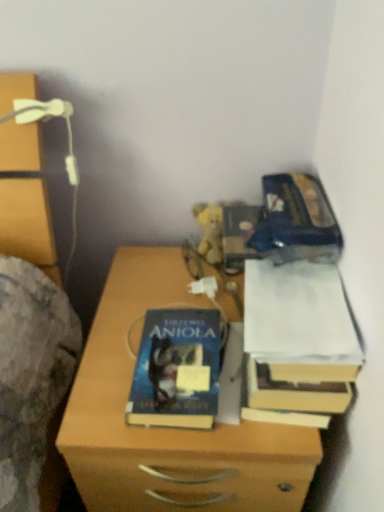
At what (x,y) coordinates should I click in order to perform the action: click on vacant space to the left of hardcover book at center. Please return your answer as a coordinate pair (x, y). This screenshot has width=384, height=512. Looking at the image, I should click on (103, 379).